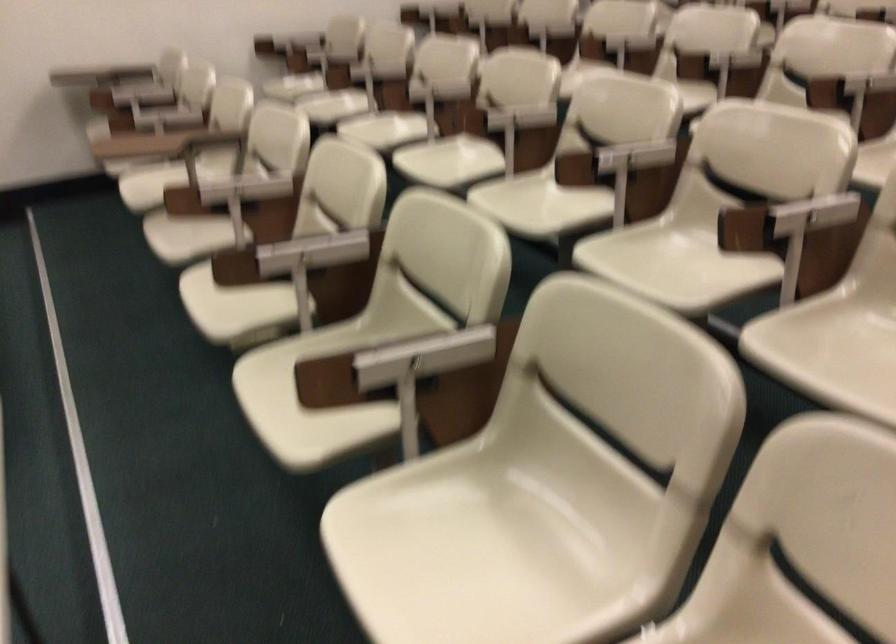
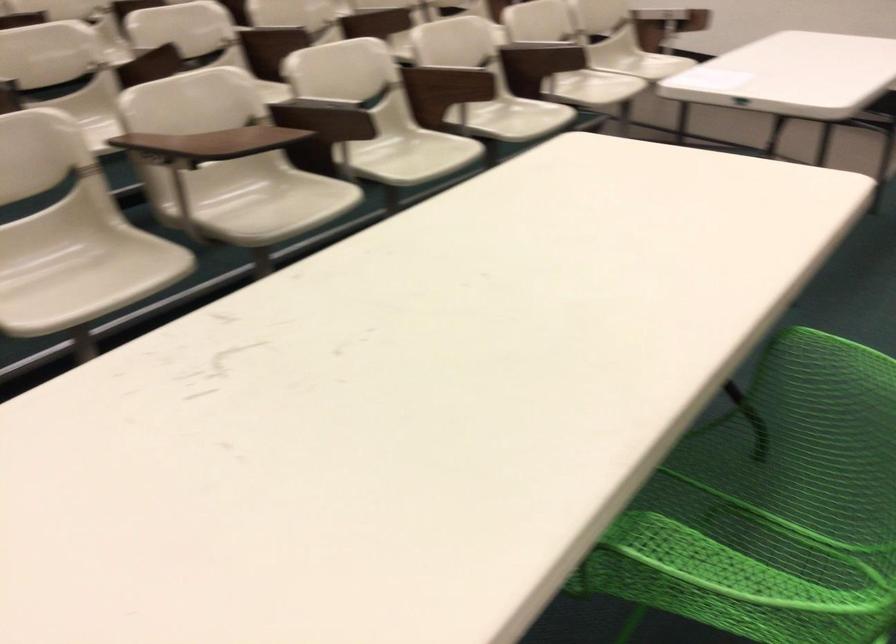
Question: I am providing you with two images of the same scene from different viewpoints. Which of the following objects are not visible in image2?

Choices:
 (A) wooden peg
 (B) green chair armrest
 (C) wooden chair armrest
 (D) white chair sitting surface

Answer: (D)